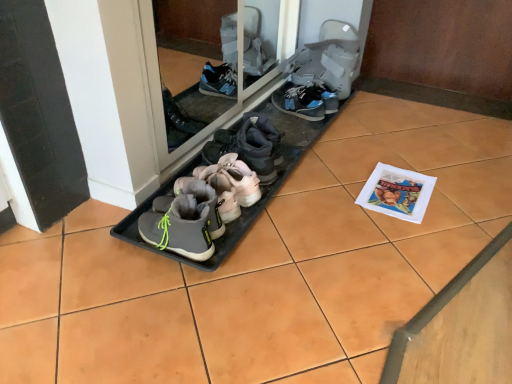
Question: Is gray suede booties at center, acting as the 1th footwear starting from the front, closer to the viewer compared to transparent glass door at center?

Choices:
 (A) yes
 (B) no

Answer: (A)

Question: Can you confirm if gray suede booties at center, acting as the 1th footwear starting from the front, is taller than transparent glass door at center?

Choices:
 (A) yes
 (B) no

Answer: (B)

Question: From the image's perspective, is gray suede booties at center, acting as the seventh footwear starting from the back, under transparent glass door at center?

Choices:
 (A) no
 (B) yes

Answer: (B)

Question: Is transparent glass door at center surrounded by gray suede booties at center, acting as the 1th footwear starting from the front?

Choices:
 (A) yes
 (B) no

Answer: (B)

Question: Could you tell me if gray suede booties at center, acting as the 1th footwear starting from the front, is turned towards transparent glass door at center?

Choices:
 (A) yes
 (B) no

Answer: (B)

Question: In terms of height, does gray suede sneaker at center, which appears as the second footwear when viewed from the back, look taller or shorter compared to gray suede booties at center, acting as the 1th footwear starting from the front?

Choices:
 (A) tall
 (B) short

Answer: (B)

Question: Does point (274, 99) appear closer or farther from the camera than point (177, 210)?

Choices:
 (A) closer
 (B) farther

Answer: (B)

Question: Is gray suede sneaker at center, positioned as the sixth footwear in front-to-back order, bigger or smaller than gray suede booties at center, acting as the seventh footwear starting from the back?

Choices:
 (A) big
 (B) small

Answer: (A)

Question: From a real-world perspective, is gray suede sneaker at center, positioned as the sixth footwear in front-to-back order, physically located above or below gray suede booties at center, acting as the 1th footwear starting from the front?

Choices:
 (A) above
 (B) below

Answer: (B)

Question: From a real-world perspective, relative to gray fabric sneakers at center, positioned as the fourth footwear in front-to-back order, is gray rubber boots at center, which appears as the 2th footwear when viewed from the front, vertically above or below?

Choices:
 (A) above
 (B) below

Answer: (B)

Question: Is gray rubber boots at center, which appears as the sixth footwear when viewed from the back, inside the boundaries of gray fabric sneakers at center, positioned as the 4th footwear in back-to-front order, or outside?

Choices:
 (A) outside
 (B) inside

Answer: (A)

Question: Relative to gray fabric sneakers at center, positioned as the fourth footwear in front-to-back order, is gray rubber boots at center, which appears as the sixth footwear when viewed from the back, in front or behind?

Choices:
 (A) front
 (B) behind

Answer: (A)

Question: Looking at their shapes, would you say gray rubber boots at center, which appears as the sixth footwear when viewed from the back, is wider or thinner than gray fabric sneakers at center, positioned as the 4th footwear in back-to-front order?

Choices:
 (A) thin
 (B) wide

Answer: (B)

Question: In terms of size, does gray suede booties at center, acting as the 1th footwear starting from the front, appear bigger or smaller than gray fabric boot at center, acting as the 7th footwear starting from the front?

Choices:
 (A) small
 (B) big

Answer: (A)

Question: From the image's perspective, is gray suede booties at center, acting as the 1th footwear starting from the front, above or below gray fabric boot at center, acting as the 7th footwear starting from the front?

Choices:
 (A) above
 (B) below

Answer: (B)